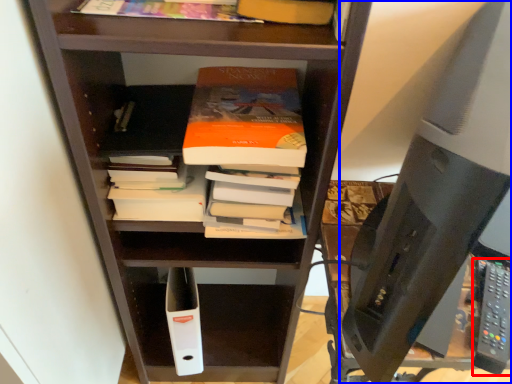
Question: Which object is further to the camera taking this photo, remote (highlighted by a red box) or desktop computer (highlighted by a blue box)?

Choices:
 (A) remote
 (B) desktop computer

Answer: (A)